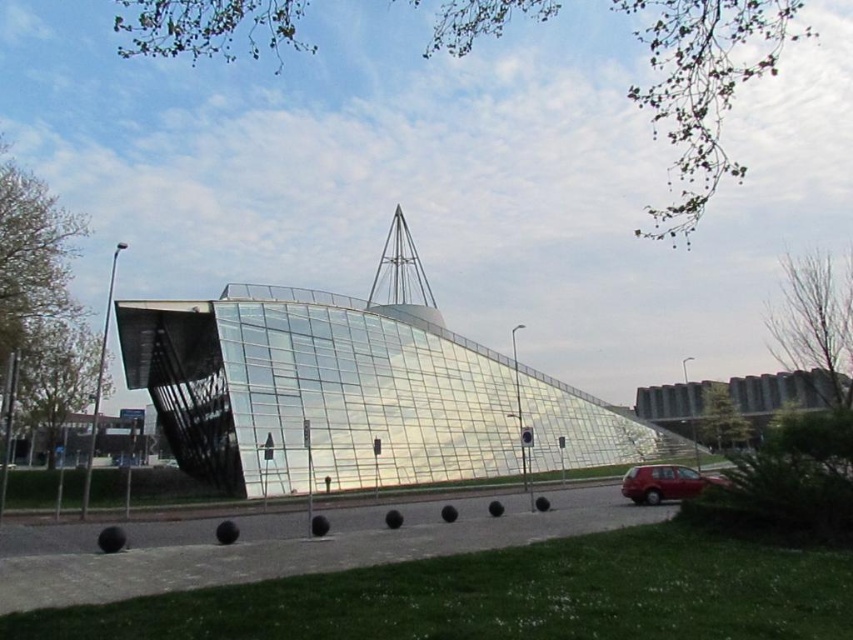
Question: Does transparent glass pyramid at center appear on the right side of shiny red car at lower right?

Choices:
 (A) yes
 (B) no

Answer: (B)

Question: Which object is the farthest from the transparent glass building at center?

Choices:
 (A) transparent glass pyramid at center
 (B) shiny red car at lower right

Answer: (B)

Question: Which is farther from the shiny red car at lower right?

Choices:
 (A) transparent glass building at center
 (B) transparent glass pyramid at center

Answer: (B)

Question: Does transparent glass building at center have a larger size compared to shiny red car at lower right?

Choices:
 (A) no
 (B) yes

Answer: (B)

Question: Can you confirm if transparent glass building at center is positioned to the right of transparent glass pyramid at center?

Choices:
 (A) no
 (B) yes

Answer: (B)

Question: Which of these objects is positioned closest to the shiny red car at lower right?

Choices:
 (A) transparent glass pyramid at center
 (B) transparent glass building at center

Answer: (B)